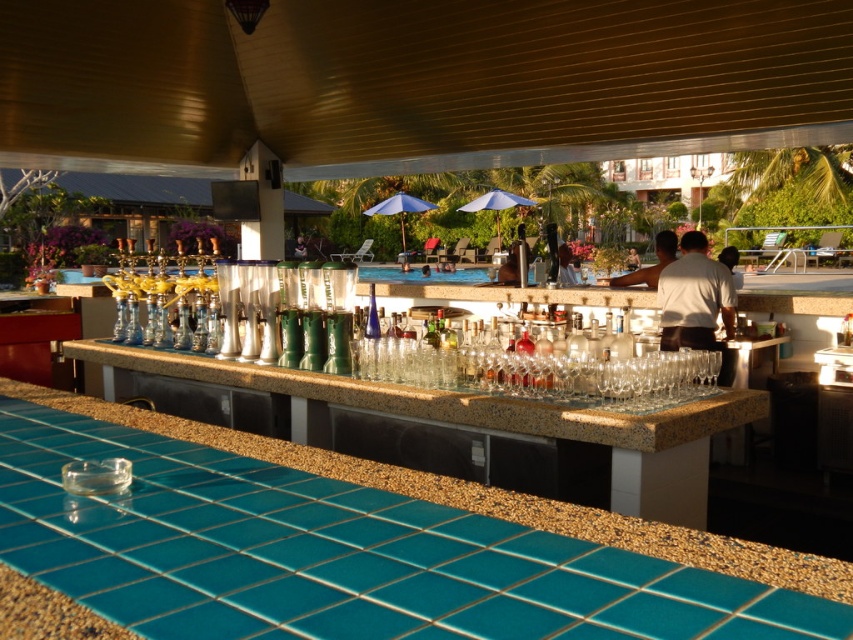
Which is above, teal tile countertop at lower left or white shirt at upper center?

white shirt at upper center

Is point (36, 592) behind point (618, 285)?

That is False.

Locate an element on the screen. teal tile countertop at lower left is located at coordinates (485, 499).

Is point (671, 337) positioned behind point (618, 278)?

No.

Does white matte shirt at center appear on the right side of white shirt at upper center?

In fact, white matte shirt at center is to the left of white shirt at upper center.

Where is `white matte shirt at center`? The image size is (853, 640). white matte shirt at center is located at coordinates (695, 301).

Which is more to the right, teal tile countertop at lower left or white matte shirt at center?

Positioned to the right is white matte shirt at center.

The width and height of the screenshot is (853, 640). Describe the element at coordinates (485, 499) in the screenshot. I see `teal tile countertop at lower left` at that location.

Where is `teal tile countertop at lower left`? The image size is (853, 640). teal tile countertop at lower left is located at coordinates (485, 499).